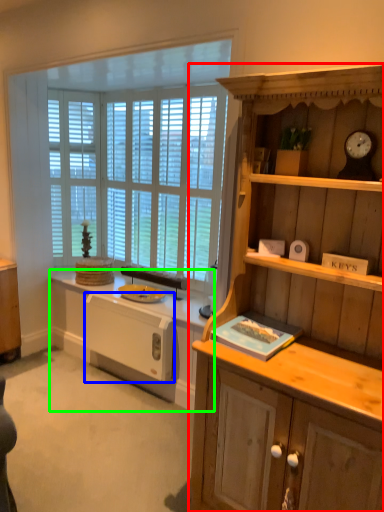
Question: Which is nearer to the cabinetry (highlighted by a red box)? appliance (highlighted by a blue box) or countertop (highlighted by a green box).

Choices:
 (A) appliance
 (B) countertop

Answer: (B)